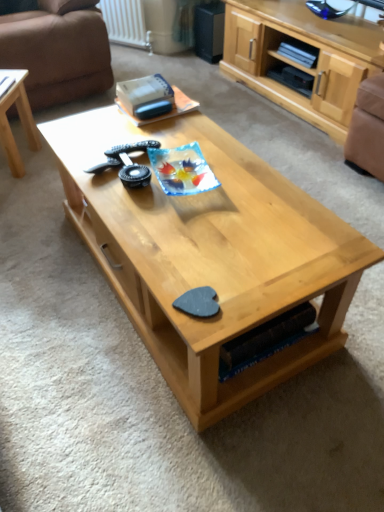
I want to click on free space that is to the left of brown fabric armchair at right, so click(329, 158).